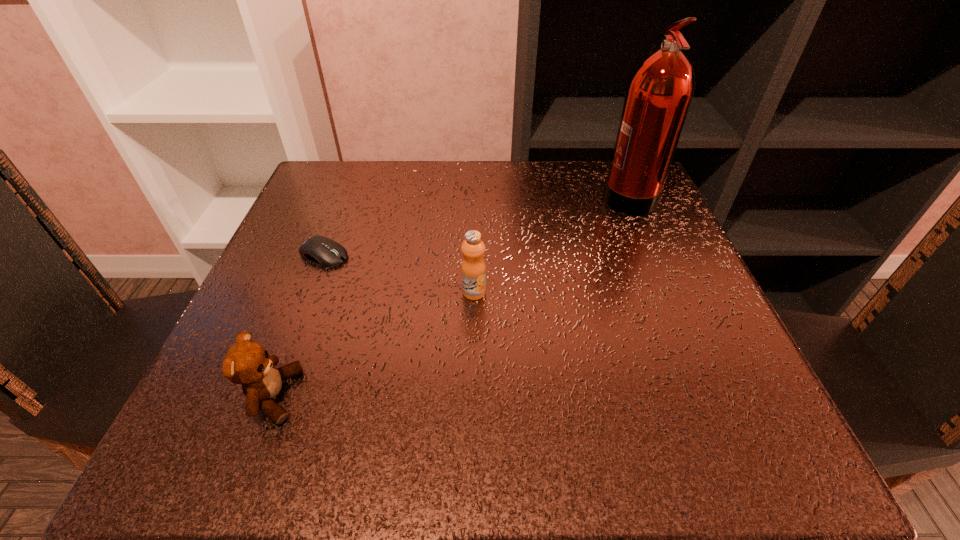
Identify the location of unoccupied position between the rightmost object and the nearest object. (450, 295).

What are the coordinates of `free space between the second object from right to left and the teddy bear` in the screenshot? It's located at (373, 344).

Locate an element on the screen. The height and width of the screenshot is (540, 960). free spot between the second farthest object and the teddy bear is located at coordinates (299, 325).

The image size is (960, 540). In order to click on free space between the computer equipment and the second object from right to left in this screenshot , I will do `click(399, 273)`.

The height and width of the screenshot is (540, 960). Identify the location of free space between the shortest object and the third farthest object. (399, 273).

Locate an element on the screen. free area in between the fire extinguisher and the second farthest object is located at coordinates (475, 225).

At what (x,y) coordinates should I click in order to perform the action: click on vacant space that is in between the third nearest object and the orange juice. Please return your answer as a coordinate pair (x, y). Looking at the image, I should click on (399, 273).

Where is `object that ranks as the second closest to the orange juice`? This screenshot has width=960, height=540. object that ranks as the second closest to the orange juice is located at coordinates (248, 363).

Locate which object is the third closest to the orange juice. Please provide its 2D coordinates. Your answer should be formatted as a tuple, i.e. [(x, y)], where the tuple contains the x and y coordinates of a point satisfying the conditions above.

[(659, 93)]

Locate an element on the screen. Image resolution: width=960 pixels, height=540 pixels. free location that satisfies the following two spatial constraints: 1. on the front-facing side of the tallest object; 2. on the front label of the orange juice is located at coordinates (669, 292).